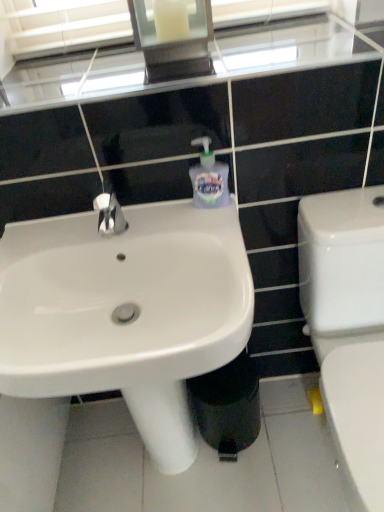
Question: In which direction should I rotate to look at black plastic trash bin/can at lower center?

Choices:
 (A) left
 (B) right

Answer: (B)

Question: Is white glossy toilet at right to the right of white glossy sink at center from the viewer's perspective?

Choices:
 (A) yes
 (B) no

Answer: (A)

Question: Is white glossy toilet at right not within white glossy sink at center?

Choices:
 (A) yes
 (B) no

Answer: (A)

Question: From the image's perspective, is white glossy toilet at right below white glossy sink at center?

Choices:
 (A) no
 (B) yes

Answer: (B)

Question: Considering the relative positions of white glossy toilet at right and white glossy sink at center in the image provided, is white glossy toilet at right in front of white glossy sink at center?

Choices:
 (A) no
 (B) yes

Answer: (B)

Question: From the image's perspective, is white glossy toilet at right above white glossy sink at center?

Choices:
 (A) no
 (B) yes

Answer: (A)

Question: Considering the relative sizes of white glossy toilet at right and white glossy sink at center in the image provided, is white glossy toilet at right smaller than white glossy sink at center?

Choices:
 (A) no
 (B) yes

Answer: (A)

Question: Is white glossy sink at center wider than translucent plastic soap dispenser at center?

Choices:
 (A) no
 (B) yes

Answer: (B)

Question: From a real-world perspective, is white glossy sink at center under translucent plastic soap dispenser at center?

Choices:
 (A) no
 (B) yes

Answer: (B)

Question: Is the position of white glossy sink at center more distant than that of translucent plastic soap dispenser at center?

Choices:
 (A) no
 (B) yes

Answer: (A)

Question: Is white glossy sink at center thinner than translucent plastic soap dispenser at center?

Choices:
 (A) yes
 (B) no

Answer: (B)

Question: Is white glossy sink at center shorter than translucent plastic soap dispenser at center?

Choices:
 (A) no
 (B) yes

Answer: (A)

Question: Considering the relative positions of white glossy sink at center and translucent plastic soap dispenser at center in the image provided, is white glossy sink at center to the left of translucent plastic soap dispenser at center from the viewer's perspective?

Choices:
 (A) yes
 (B) no

Answer: (A)

Question: Does black plastic trash bin/can at lower center lie behind white glossy toilet at right?

Choices:
 (A) no
 (B) yes

Answer: (B)